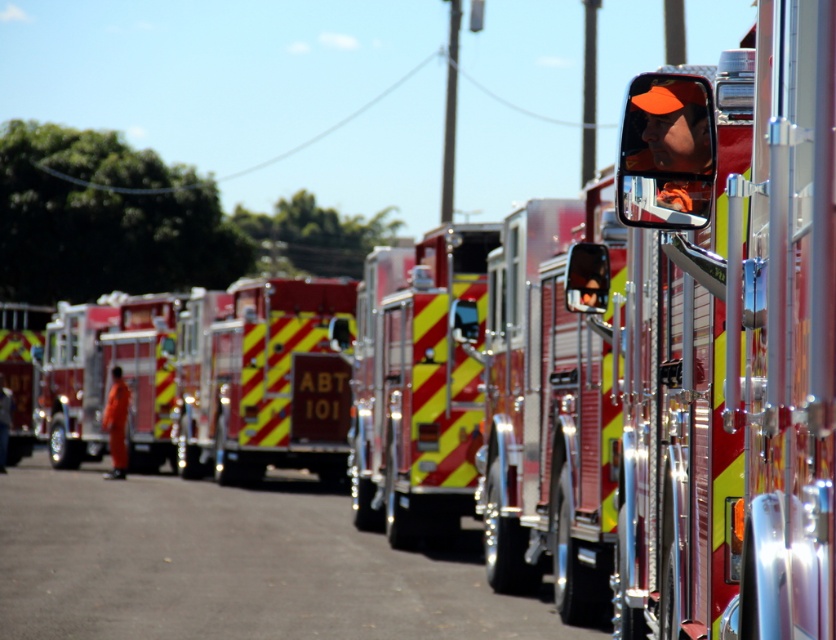
Question: Does reflective silver fire truck at center come behind red/yellow striped fire truck at left?

Choices:
 (A) no
 (B) yes

Answer: (A)

Question: Is shiny chrome fire truck at center wider than reflective silver fire truck at center?

Choices:
 (A) no
 (B) yes

Answer: (A)

Question: Estimate the real-world distances between objects in this image. Which object is closer to the orange fabric fireman at center?

Choices:
 (A) reflective silver fire truck at center
 (B) shiny chrome fire truck at center
 (C) metallic red fire truck at left

Answer: (C)

Question: Does orange reflective mirror at center come in front of reflective glass mirror at center?

Choices:
 (A) yes
 (B) no

Answer: (A)

Question: Which point is farther to the camera?

Choices:
 (A) (337, 314)
 (B) (794, 436)

Answer: (A)

Question: Which is nearer to the reflective glass mirror at center?

Choices:
 (A) metallic red fire truck at left
 (B) red/yellow striped fire truck at left

Answer: (B)